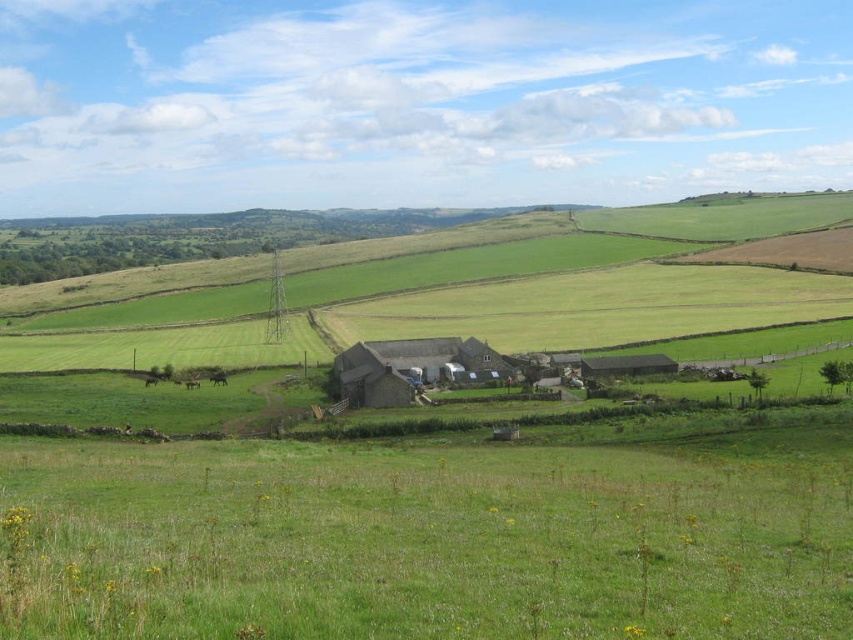
You are standing in the middle of the green grassy field at lower center and want to reach the stone barn at center. Which direction should you walk to get there?

You should walk to the left because the green grassy field at lower center is to the right of the stone barn at center, so moving left will take you towards the barn.

You are standing at the center of the image and want to find the green grassy field at lower center. According to the coordinates provided, in which direction should you look to locate it?

The green grassy field at lower center is located at coordinates approximately 0.845 on the x and 0.499 on the y axis. Since the question mentions it is at lower center, you should look downward from the center of the image to find it.